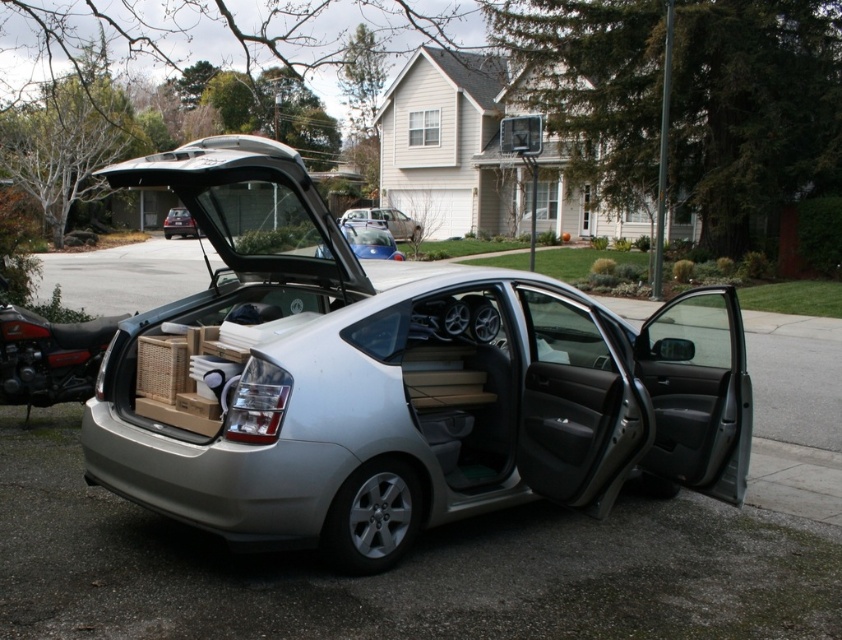
You are standing in front of the silver sedan with two open doors. There are two points marked on the car. One is at coordinate point [453,321] and the other at point [398,253]. Which point is closer to you?

Point [453,321] is closer to the viewer than point [398,253].